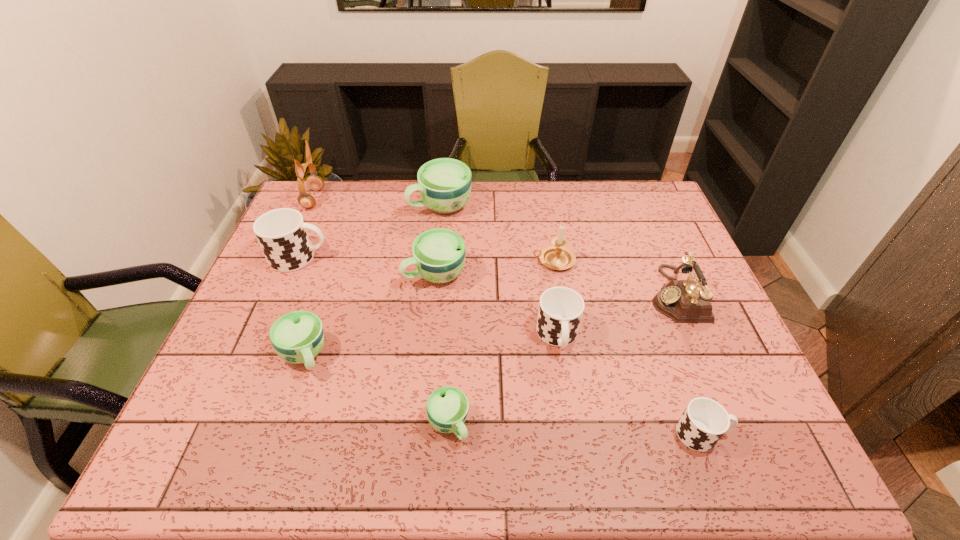
Where is `earphone`? earphone is located at coordinates (315, 183).

You are a GUI agent. You are given a task and a screenshot of the screen. Output one action in this format:
    pyautogui.click(x=<x>, y=<y>)
    Task: Click on the brown earphone
    This screenshot has height=540, width=960.
    Given the screenshot: What is the action you would take?
    pyautogui.click(x=315, y=183)

The height and width of the screenshot is (540, 960). Find the location of `the biggest blue cup`. the biggest blue cup is located at coordinates (444, 184).

The image size is (960, 540). I want to click on the farthest cup, so click(444, 184).

This screenshot has height=540, width=960. Identify the location of candle holder. (558, 257).

Identify the location of the farthest black cup. The height and width of the screenshot is (540, 960). (282, 233).

At what (x,y) coordinates should I click in order to perform the action: click on the leftmost black cup. Please return your answer as a coordinate pair (x, y). Looking at the image, I should click on (282, 233).

I want to click on black telephone, so click(x=684, y=301).

Locate an element on the screen. the second biggest blue cup is located at coordinates (439, 254).

Locate an element on the screen. Image resolution: width=960 pixels, height=540 pixels. the second black cup from right to left is located at coordinates (560, 311).